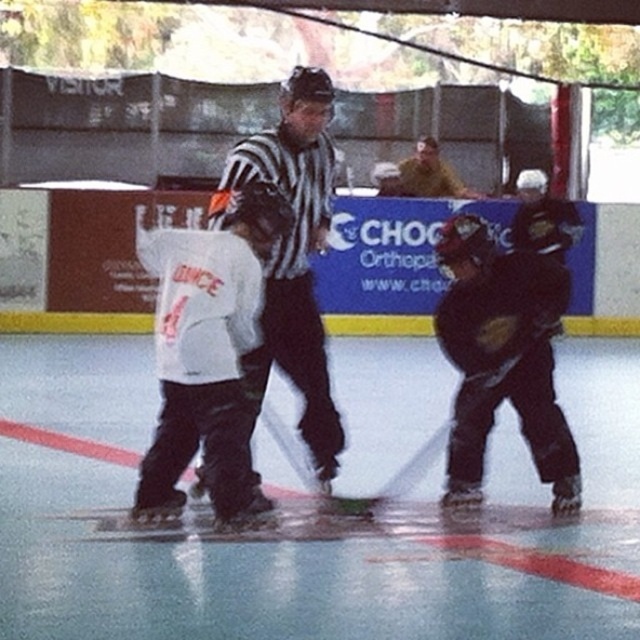
Question: Which of the following is the farthest from the observer?

Choices:
 (A) (314, 97)
 (B) (180, 420)

Answer: (A)

Question: Is white glossy ice at center wider than white jersey at center?

Choices:
 (A) yes
 (B) no

Answer: (B)

Question: Which point is farther from the camera taking this photo?

Choices:
 (A) (493, 403)
 (B) (189, 356)
 (C) (188, 624)

Answer: (A)

Question: Is white jersey at center wider than black matte hockey helmet at center?

Choices:
 (A) no
 (B) yes

Answer: (B)

Question: Is black striped shirt at center to the right of black matte hockey stick at center from the viewer's perspective?

Choices:
 (A) no
 (B) yes

Answer: (A)

Question: Considering the real-world distances, which object is closest to the black striped shirt at center?

Choices:
 (A) white glossy ice at center
 (B) black matte hockey stick at center

Answer: (B)